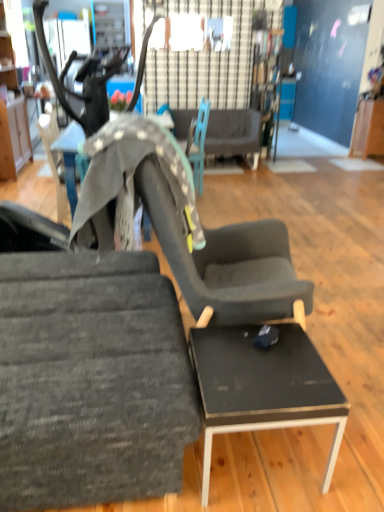
Question: Is teal fabric chair at center, marked as the second chair in a bottom-to-top arrangement, placed right next to black glossy table at center?

Choices:
 (A) yes
 (B) no

Answer: (B)

Question: Is teal fabric chair at center, marked as the second chair in a bottom-to-top arrangement, taller than black glossy table at center?

Choices:
 (A) yes
 (B) no

Answer: (A)

Question: Does teal fabric chair at center, the second chair in the front-to-back sequence, appear on the left side of black glossy table at center?

Choices:
 (A) yes
 (B) no

Answer: (B)

Question: From a real-world perspective, is teal fabric chair at center, which is counted as the 1th chair, starting from the back, located beneath black glossy table at center?

Choices:
 (A) yes
 (B) no

Answer: (A)

Question: Is teal fabric chair at center, which is counted as the 1th chair, starting from the back, wider than black glossy table at center?

Choices:
 (A) yes
 (B) no

Answer: (B)

Question: From the image's perspective, is teal fabric chair at center, marked as the second chair in a bottom-to-top arrangement, below black glossy table at center?

Choices:
 (A) no
 (B) yes

Answer: (A)

Question: Can you confirm if black glossy table at center is smaller than textured gray fabric chair at left, arranged as the first chair when viewed from the front?

Choices:
 (A) yes
 (B) no

Answer: (A)

Question: Is black glossy table at center to the right of textured gray fabric chair at left, arranged as the first chair when viewed from the front, from the viewer's perspective?

Choices:
 (A) yes
 (B) no

Answer: (A)

Question: From a real-world perspective, does black glossy table at center sit lower than textured gray fabric chair at left, arranged as the first chair when viewed from the front?

Choices:
 (A) no
 (B) yes

Answer: (A)

Question: From the image's perspective, does black glossy table at center appear higher than textured gray fabric chair at left, arranged as the first chair when viewed from the front?

Choices:
 (A) no
 (B) yes

Answer: (B)

Question: Is black glossy table at center taller than textured gray fabric chair at left, arranged as the first chair when viewed from the front?

Choices:
 (A) yes
 (B) no

Answer: (B)

Question: Is the position of black glossy table at center less distant than that of textured gray fabric chair at left, arranged as the first chair when viewed from the front?

Choices:
 (A) yes
 (B) no

Answer: (B)

Question: Can you confirm if wooden cabinet at left is wider than textured gray fabric chair at left, the 2th chair positioned from the top?

Choices:
 (A) no
 (B) yes

Answer: (A)